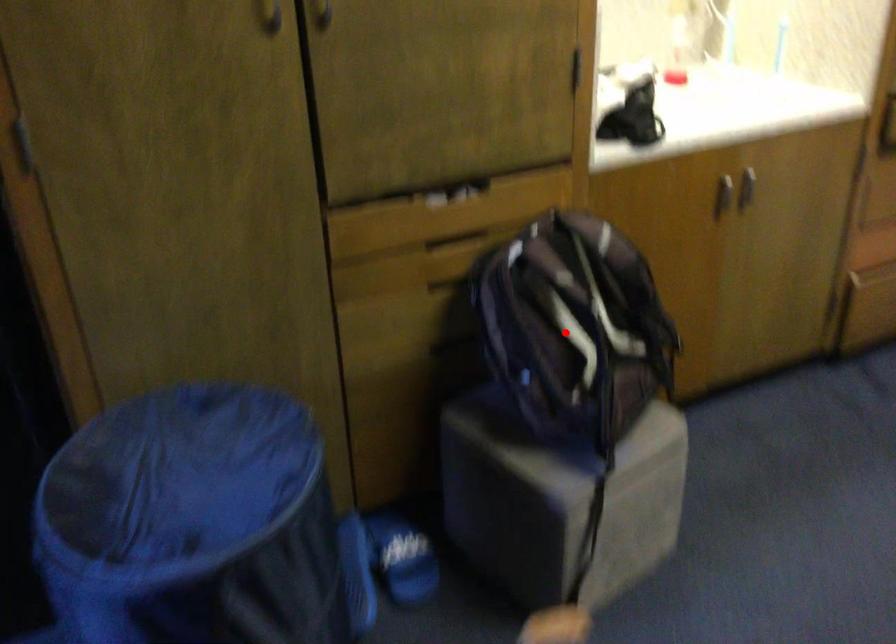
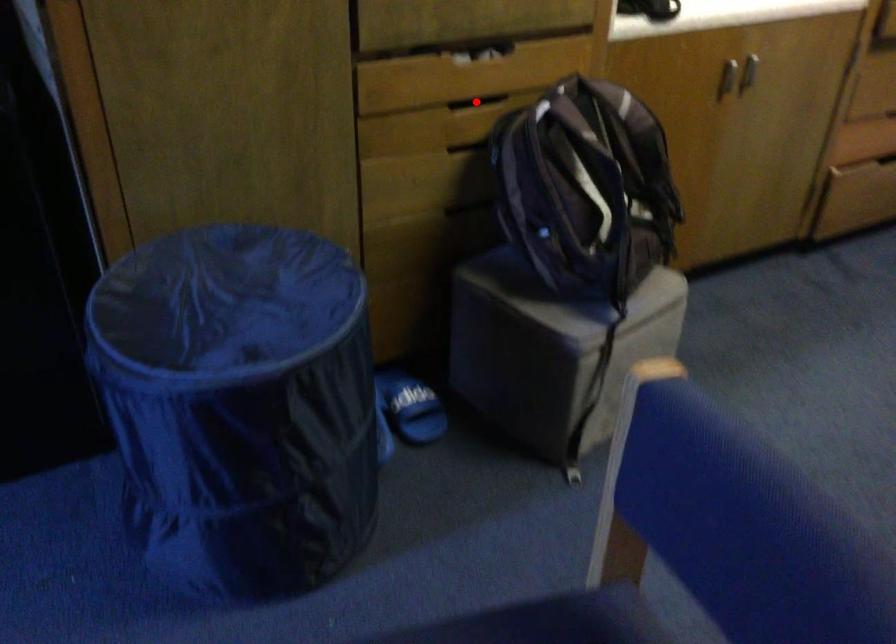
I am providing you with two images of the same scene from different viewpoints. A red point is marked on the first image and another point is marked on the second image. Do the highlighted points in image1 and image2 indicate the same real-world spot?

No